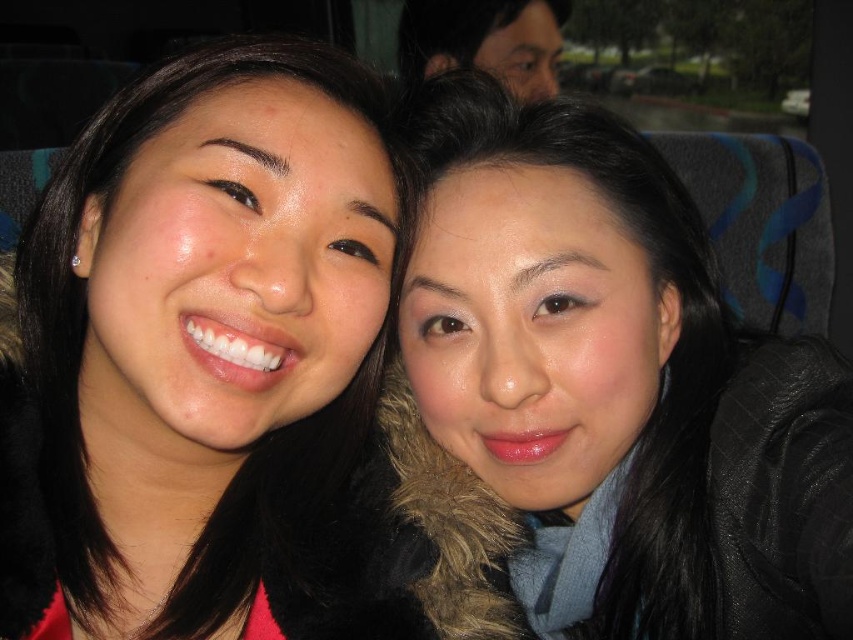
Is point (693, 428) positioned before point (515, 28)?

Yes, point (693, 428) is closer to viewer.

Can you confirm if matte black jacket at center is smaller than matte black hair at upper center?

Incorrect, matte black jacket at center is not smaller in size than matte black hair at upper center.

What do you see at coordinates (618, 381) in the screenshot? I see `matte black jacket at center` at bounding box center [618, 381].

Where is `matte black jacket at center`? The width and height of the screenshot is (853, 640). matte black jacket at center is located at coordinates (618, 381).

Is matte black hair at center shorter than matte black jacket at center?

Correct, matte black hair at center is not as tall as matte black jacket at center.

Is matte black hair at center positioned before matte black jacket at center?

Yes, it is in front of matte black jacket at center.

Which is in front, point (196, 108) or point (469, 460)?

Point (196, 108) is more forward.

This screenshot has width=853, height=640. Find the location of `matte black hair at center`. matte black hair at center is located at coordinates (198, 352).

Can you confirm if matte black hair at center is wider than matte black hair at upper center?

Incorrect, matte black hair at center's width does not surpass matte black hair at upper center's.

Which is more to the left, matte black hair at center or matte black hair at upper center?

matte black hair at center

Identify the location of matte black hair at center. (198, 352).